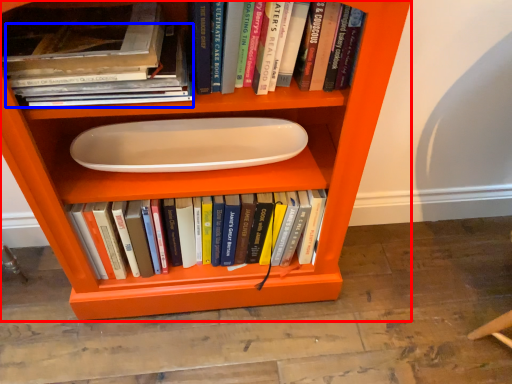
Question: Which object appears farthest to the camera in this image, shelf (highlighted by a red box) or book (highlighted by a blue box)?

Choices:
 (A) shelf
 (B) book

Answer: (B)